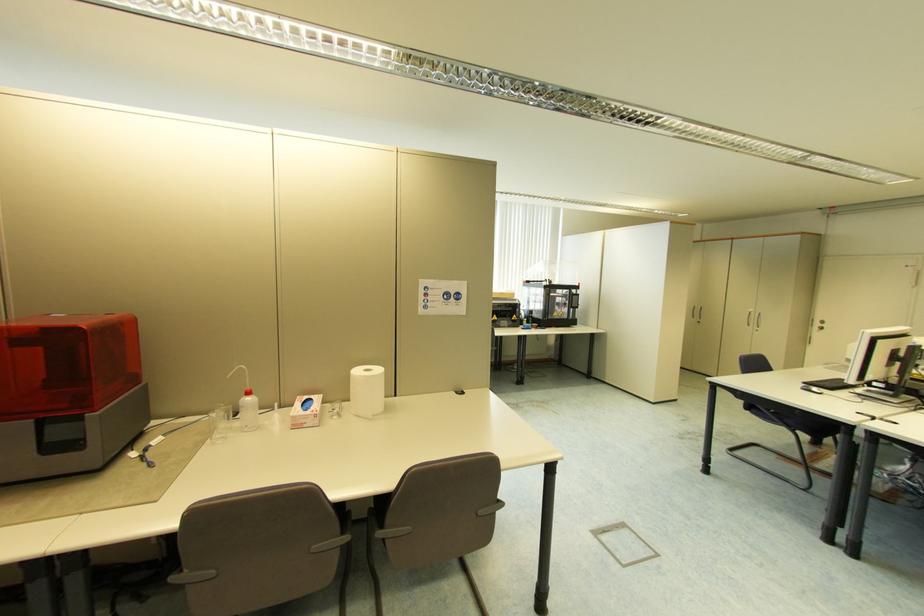
This screenshot has height=616, width=924. What do you see at coordinates (306, 411) in the screenshot? I see `the small cardboard box` at bounding box center [306, 411].